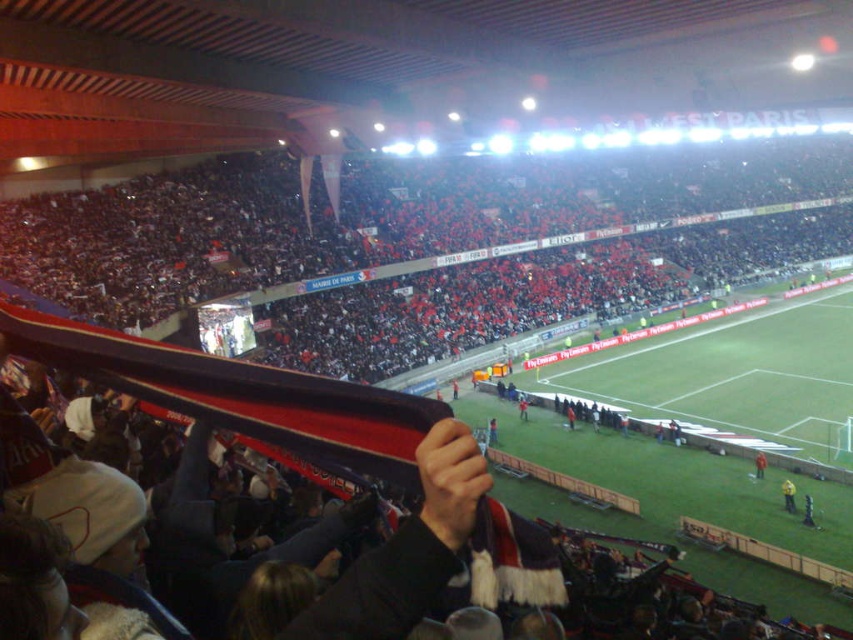
Can you confirm if red and white striped scarf at center is smaller than red fabric scarf at lower right?

No.

Is red and white striped scarf at center above red fabric scarf at lower right?

Yes.

Measure the distance between point [355,451] and camera.

Point [355,451] and camera are 9.01 meters apart.

Find the location of a particular element. The width and height of the screenshot is (853, 640). red and white striped scarf at center is located at coordinates (234, 392).

Is red and white striped scarf at center to the right of yellow fabric at lower right from the viewer's perspective?

No, red and white striped scarf at center is not to the right of yellow fabric at lower right.

Between red and white striped scarf at center and yellow fabric at lower right, which one appears on the left side from the viewer's perspective?

Positioned to the left is red and white striped scarf at center.

Does point (138, 381) lie in front of point (792, 488)?

Yes.

Image resolution: width=853 pixels, height=640 pixels. In order to click on red and white striped scarf at center in this screenshot , I will do `click(234, 392)`.

Is red fabric crowd at upper center further to camera compared to yellow fabric at lower right?

That is True.

Which is more to the right, red fabric crowd at upper center or yellow fabric at lower right?

red fabric crowd at upper center is more to the right.

Between point (106, 301) and point (782, 490), which one is positioned in front?

Point (782, 490)

You are a GUI agent. You are given a task and a screenshot of the screen. Output one action in this format:
    pyautogui.click(x=<x>, y=<y>)
    Task: Click on the red fabric crowd at upper center
    Image resolution: width=853 pixels, height=640 pixels.
    Given the screenshot: What is the action you would take?
    pyautogui.click(x=368, y=216)